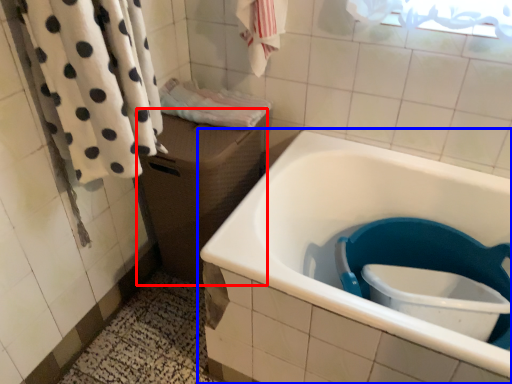
Question: Among these objects, which one is farthest to the camera, box (highlighted by a red box) or bathtub (highlighted by a blue box)?

Choices:
 (A) box
 (B) bathtub

Answer: (A)